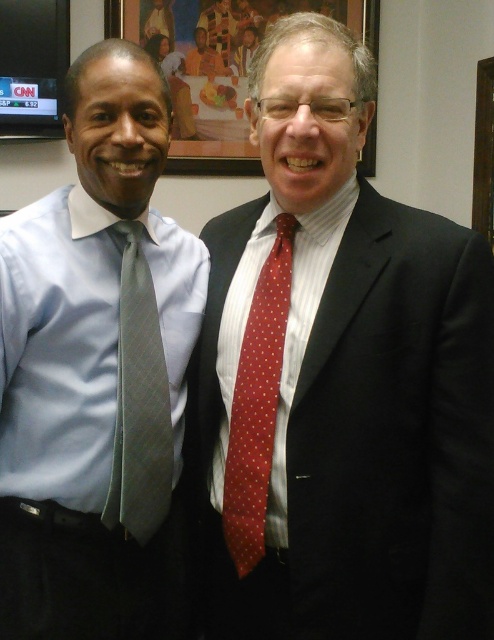
Which of these two, red dotted tie at center or red dotted tie at right, stands shorter?

red dotted tie at right is shorter.

Is red dotted tie at center above red dotted tie at right?

Yes, red dotted tie at center is above red dotted tie at right.

Does point (452, 547) come in front of point (258, 476)?

Yes, point (452, 547) is in front of point (258, 476).

Locate an element on the screen. The width and height of the screenshot is (494, 640). red dotted tie at center is located at coordinates (339, 380).

Is wooden picture frame at upper center to the left of red dotted tie at right from the viewer's perspective?

No, wooden picture frame at upper center is not to the left of red dotted tie at right.

Is point (228, 58) closer to camera compared to point (270, 262)?

No, (228, 58) is behind (270, 262).

Identify the location of wooden picture frame at upper center. (217, 65).

Does wooden picture frame at upper center lie behind gray textured tie at left?

Yes, it is.

Between wooden picture frame at upper center and gray textured tie at left, which one appears on the right side from the viewer's perspective?

wooden picture frame at upper center is more to the right.

The height and width of the screenshot is (640, 494). Find the location of `wooden picture frame at upper center`. wooden picture frame at upper center is located at coordinates (217, 65).

In order to click on wooden picture frame at upper center in this screenshot , I will do click(217, 65).